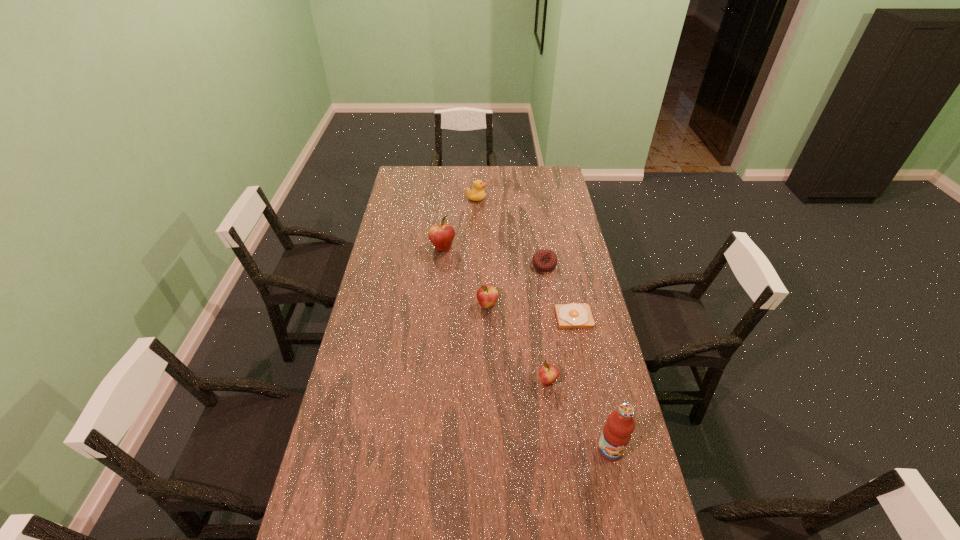
Please point a free position for a apple on the right. Please provide its 2D coordinates. Your answer should be formatted as a tuple, i.e. [(x, y)], where the tuple contains the x and y coordinates of a point satisfying the conditions above.

[(632, 490)]